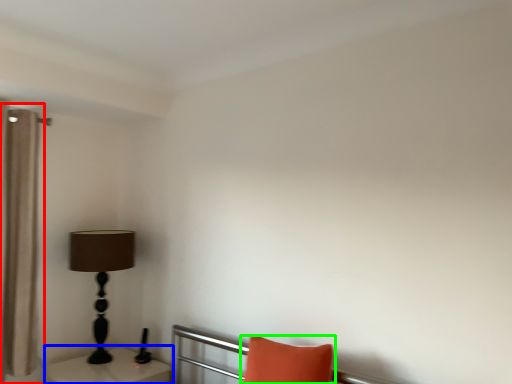
Question: Based on their relative distances, which object is farther from curtain (highlighted by a red box)? Choose from table (highlighted by a blue box) and pillow (highlighted by a green box).

Choices:
 (A) table
 (B) pillow

Answer: (B)